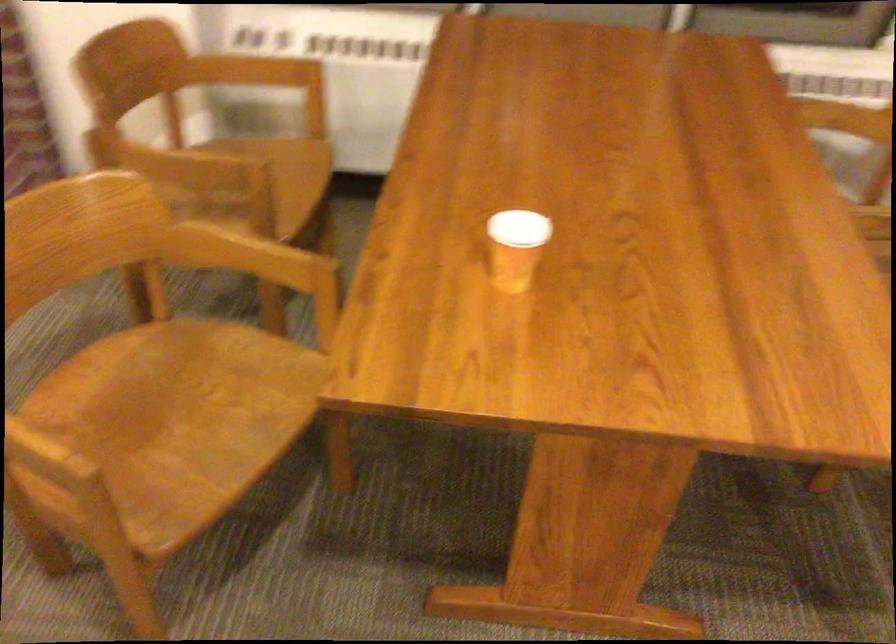
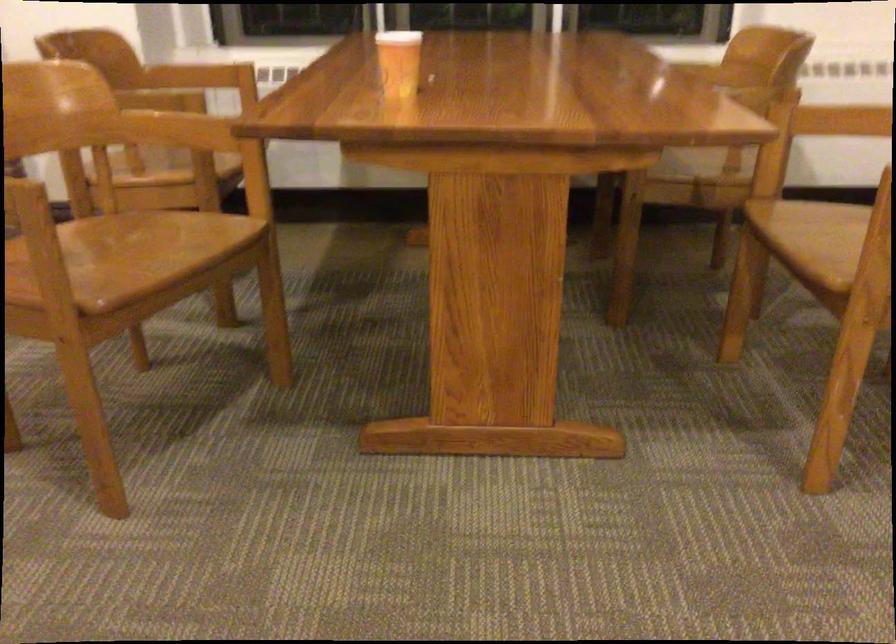
Question: The first image is from the beginning of the video and the second image is from the end. How did the camera likely rotate when shooting the video?

Choices:
 (A) Left
 (B) Right
 (C) Up
 (D) Down

Answer: (C)